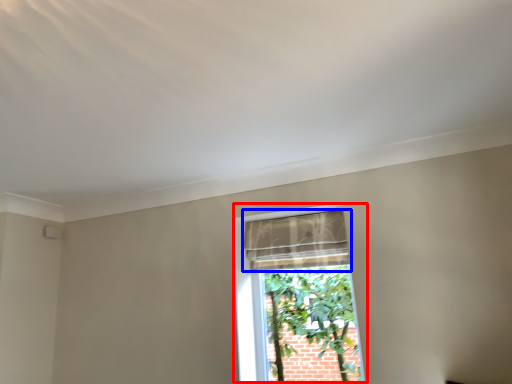
Question: Which object is further to the camera taking this photo, window (highlighted by a red box) or curtain (highlighted by a blue box)?

Choices:
 (A) window
 (B) curtain

Answer: (B)